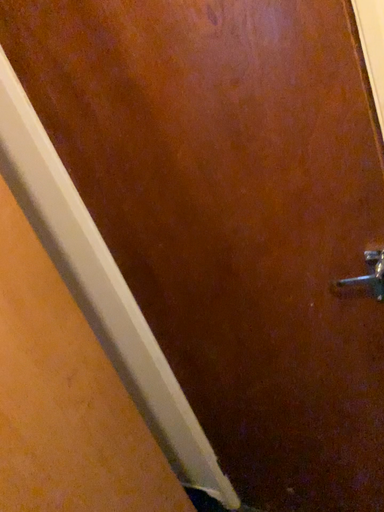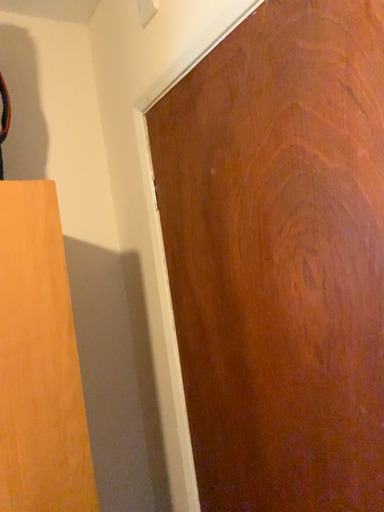
Question: Which way did the camera rotate in the video?

Choices:
 (A) rotated right
 (B) rotated left

Answer: (B)